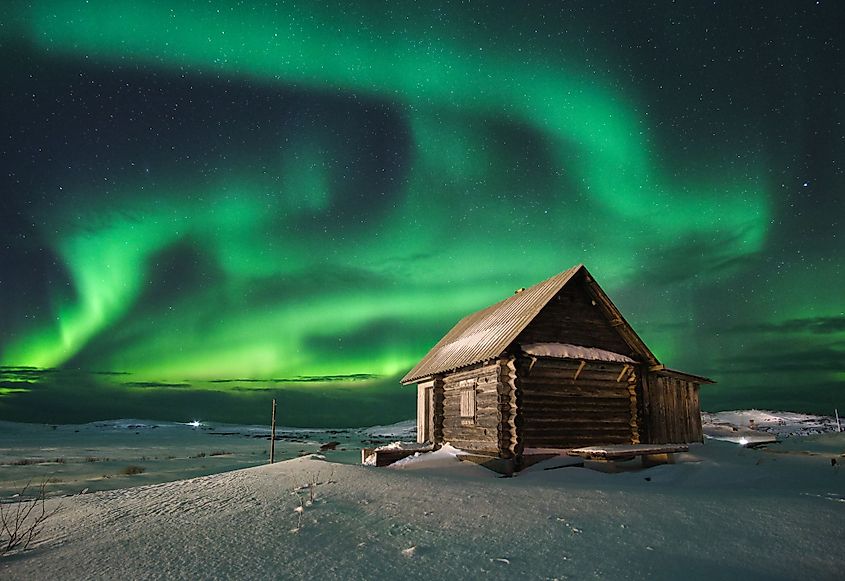
This screenshot has height=581, width=845. In order to click on wooden roof in this screenshot , I will do `click(620, 332)`.